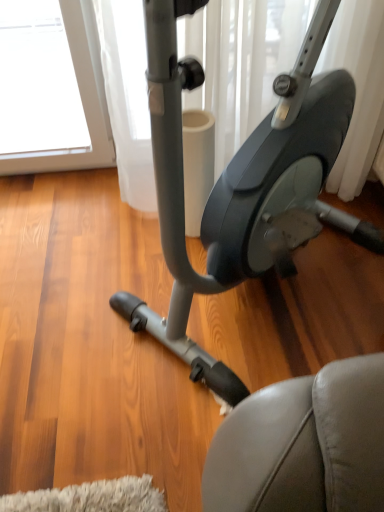
Where is `vacant space situated on the left part of matte black stationary bicycle at center`? vacant space situated on the left part of matte black stationary bicycle at center is located at coordinates (69, 278).